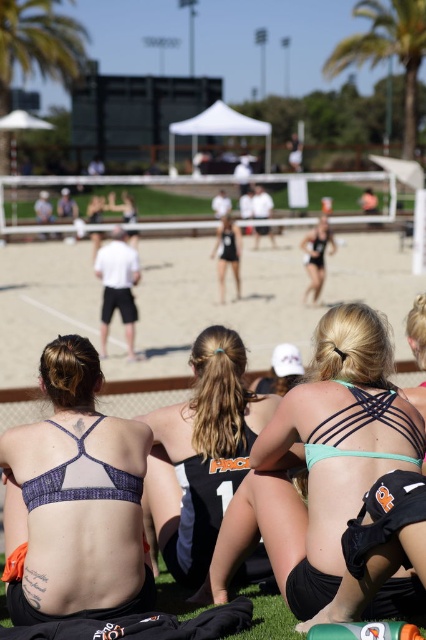
You are a photographer positioned at the edge of the volleyball court. You want to take a photo that includes both the matte black bikini top at center and the green leafy palm tree at upper center. Which object should be placed on the left side of the photo frame to ensure both are visible?

The matte black bikini top at center should be placed on the left side of the photo frame because it is already positioned to the left of the green leafy palm tree at upper center, ensuring both are visible in the frame.

You are a photographer positioned behind the volleyball net. You want to capture a photo of the teal fabric bikini top at center without including the sandy beach at center in the frame. Is this possible based on their positions?

The sandy beach at center is to the left of the teal fabric bikini top at center, so if you position the camera to the right side of the teal fabric bikini top at center, you can exclude the sandy beach at center from the frame.

You are a photographer trying to capture a closeup of the matte black bikini top at center and the green leafy palm tree at upper center in the beach volleyball scene. Since you want both subjects to be clearly visible, which one should you zoom in on more to ensure it doesn t appear too small in the photo?

The matte black bikini top at center is smaller than the green leafy palm tree at upper center, so you should zoom in more on the matte black bikini top at center to ensure it doesn t appear too small in the photo.